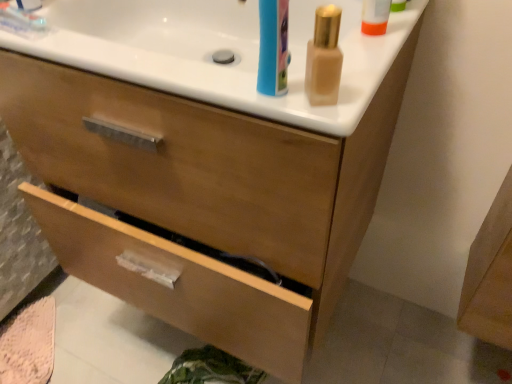
What are the coordinates of `free space to the back side of satin gold bottle at upper right` in the screenshot? It's located at (359, 46).